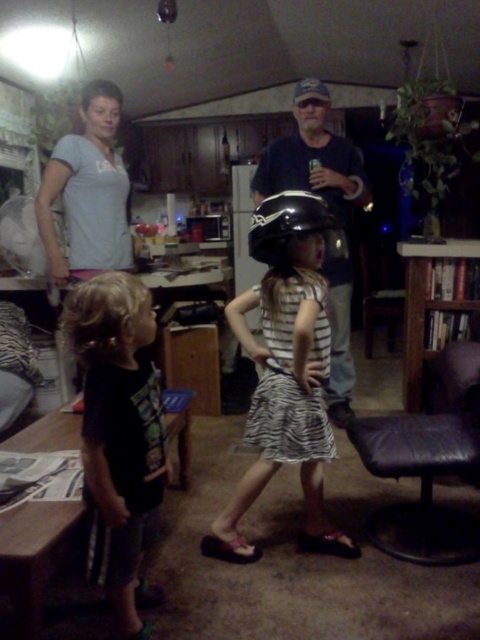
Question: Which point is closer to the camera?

Choices:
 (A) (314, 360)
 (B) (342, 182)
 (C) (326, 241)
 (D) (99, 502)

Answer: (D)

Question: Does black cotton shirt at left have a larger size compared to gray cotton shirt at upper left?

Choices:
 (A) no
 (B) yes

Answer: (A)

Question: Is zebra print dress at center in front of dark blue denim shirt at center?

Choices:
 (A) no
 (B) yes

Answer: (B)

Question: Does gray cotton shirt at upper left come in front of dark blue denim shirt at center?

Choices:
 (A) yes
 (B) no

Answer: (B)

Question: Which object is closer to the camera taking this photo?

Choices:
 (A) black cotton shirt at left
 (B) gray cotton shirt at upper left

Answer: (A)

Question: Which object is closer to the camera taking this photo?

Choices:
 (A) zebra print dress at center
 (B) dark blue denim shirt at center
 (C) gray cotton shirt at upper left

Answer: (A)